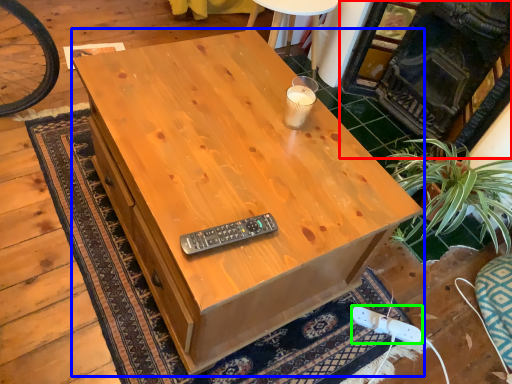
Question: Which object is the farthest from fireplace (highlighted by a red box)? Choose among these: desk (highlighted by a blue box) or plug (highlighted by a green box).

Choices:
 (A) desk
 (B) plug

Answer: (B)